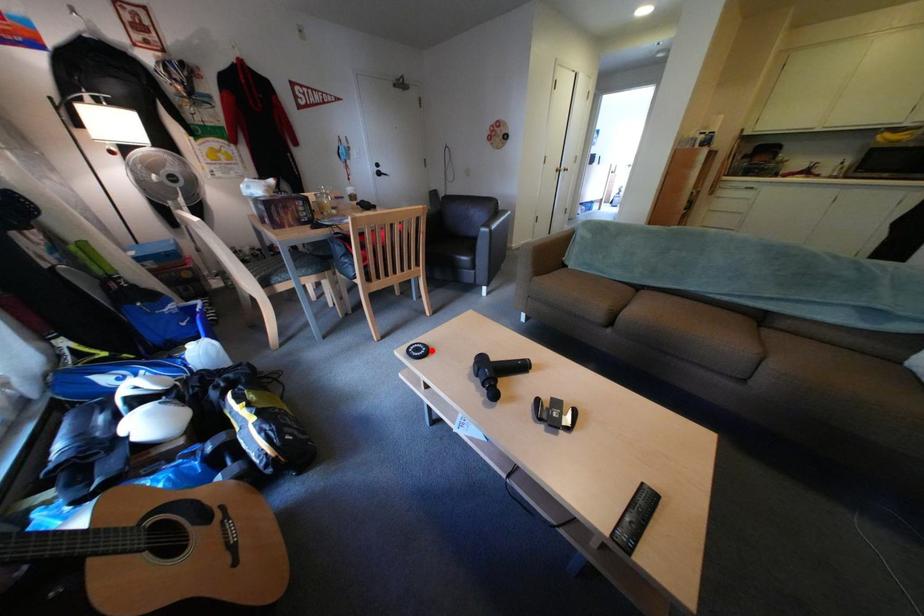
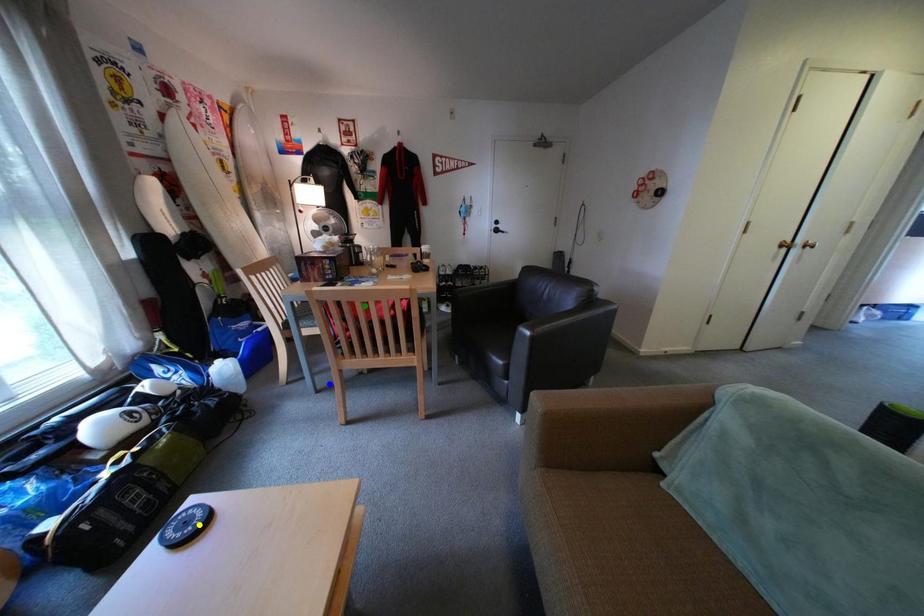
Question: I am providing you with two images of the same scene from different viewpoints. A red point is marked on the first image. You are given multiple points on the second image. Which point in image 2 represents the same 3d spot as the red point in image 1?

Choices:
 (A) green point
 (B) blue point
 (C) yellow point

Answer: (C)